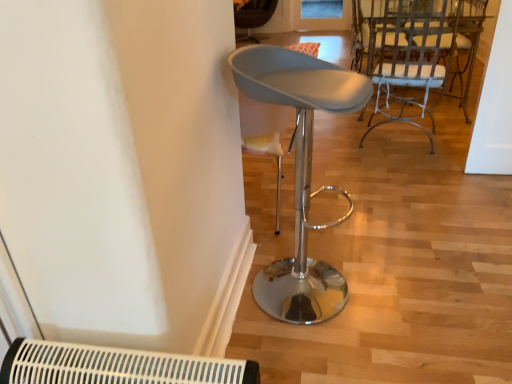
Question: Is white plastic air conditioning unit at lower left to the left or to the right of matte gray stool at center, the 1th chair in the front-to-back sequence, in the image?

Choices:
 (A) left
 (B) right

Answer: (A)

Question: Relative to matte gray stool at center, arranged as the 1th chair when ordered from the bottom, is white plastic air conditioning unit at lower left in front or behind?

Choices:
 (A) front
 (B) behind

Answer: (A)

Question: Estimate the real-world distances between objects in this image. Which object is closer to the velvet brown chair at center, the third chair positioned from the right?

Choices:
 (A) white plastic air conditioning unit at lower left
 (B) white painted metal chair at upper right, which is the 3th chair in left-to-right order
 (C) matte gray stool at center, which ranks as the third chair in top-to-bottom order

Answer: (B)

Question: Which is nearer to the velvet brown chair at center, the third chair in the bottom-to-top sequence?

Choices:
 (A) matte gray stool at center, marked as the 2th chair in a left-to-right arrangement
 (B) white painted metal chair at upper right, which is the 2th chair in top-to-bottom order
 (C) white plastic air conditioning unit at lower left

Answer: (B)